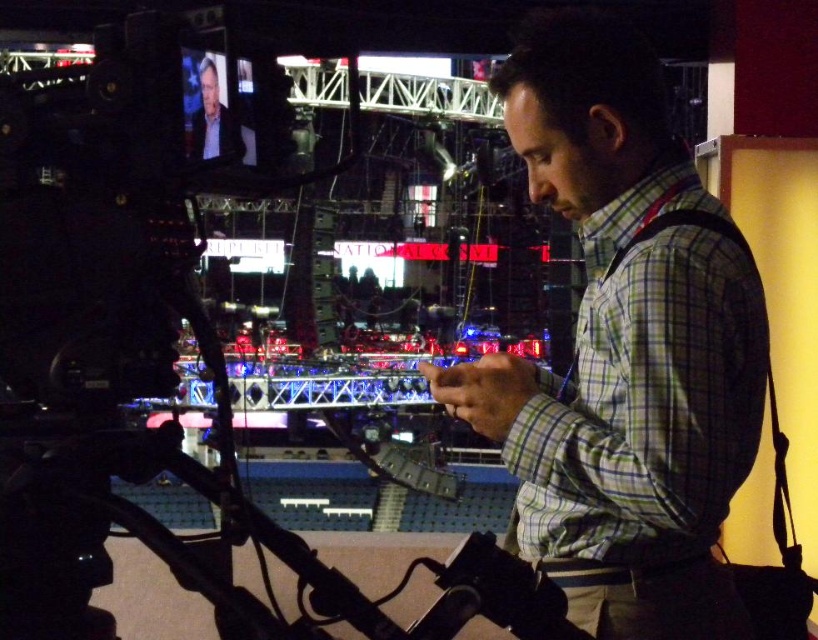
Question: Does green checkered shirt at center have a larger size compared to light gray suit at upper left?

Choices:
 (A) yes
 (B) no

Answer: (A)

Question: Is the position of green checkered shirt at center more distant than that of light gray suit at upper left?

Choices:
 (A) yes
 (B) no

Answer: (A)

Question: Does green checkered shirt at center have a smaller size compared to light gray suit at upper left?

Choices:
 (A) yes
 (B) no

Answer: (B)

Question: Among these points, which one is farthest from the camera?

Choices:
 (A) (214, 120)
 (B) (605, 330)

Answer: (B)

Question: Among these objects, which one is nearest to the camera?

Choices:
 (A) green checkered shirt at center
 (B) light gray suit at upper left

Answer: (B)

Question: Which point is closer to the camera taking this photo?

Choices:
 (A) (641, 403)
 (B) (199, 77)

Answer: (B)